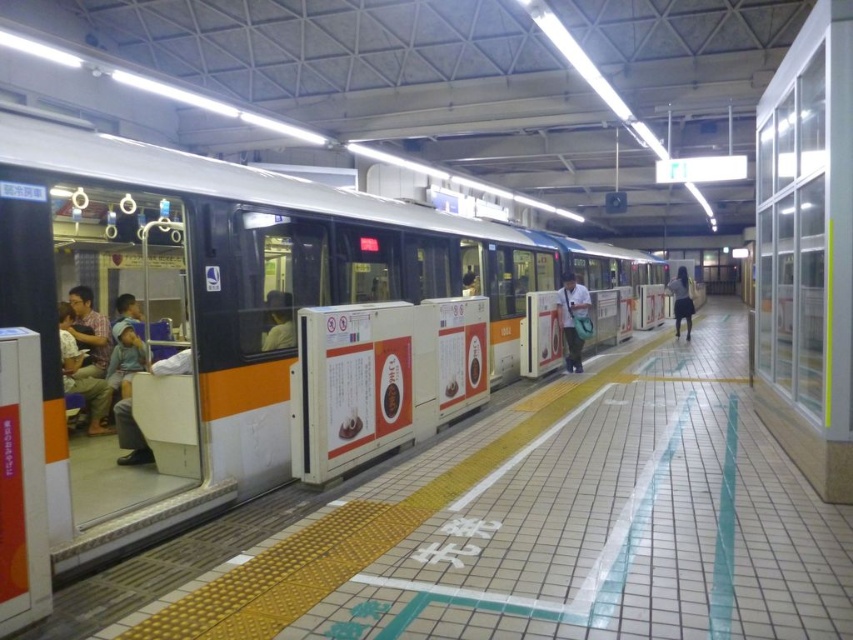
Can you confirm if matte black shirt at left is positioned above white fabric bag at center?

A: Actually, matte black shirt at left is below white fabric bag at center.

Can you confirm if matte black shirt at left is thinner than white fabric bag at center?

Yes.

Who is more distant from viewer, (85,339) or (578,284)?

Point (578,284)

Where is `matte black shirt at left`? matte black shirt at left is located at coordinates (90, 330).

Does point (67, 355) come behind point (292, 323)?

That is True.

Can you confirm if matte orange seat at left is wider than matte gray shirt at center?

Yes.

Which is behind, point (71, 316) or point (276, 320)?

Point (71, 316)

At what (x,y) coordinates should I click in order to perform the action: click on matte orange seat at left. Please return your answer as a coordinate pair (x, y). The image size is (853, 640). Looking at the image, I should click on (83, 368).

Can you confirm if white fabric bag at center is bigger than dark blue skirt at center?

Incorrect, white fabric bag at center is not larger than dark blue skirt at center.

Who is more forward, (582, 340) or (682, 300)?

Point (582, 340) is more forward.

This screenshot has height=640, width=853. I want to click on white fabric bag at center, so click(572, 317).